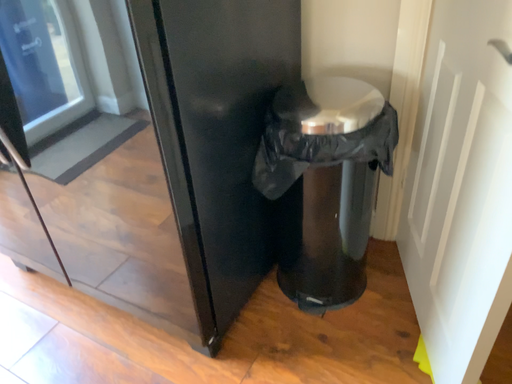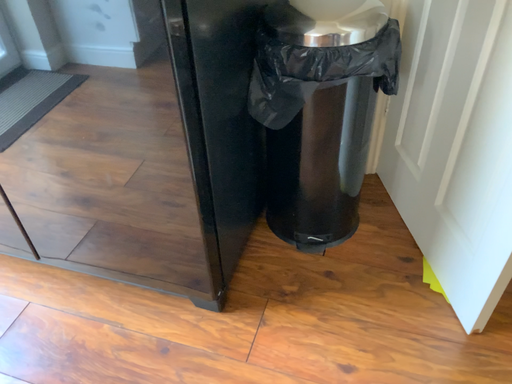
Question: How did the camera likely rotate when shooting the video?

Choices:
 (A) rotated left
 (B) rotated right

Answer: (B)